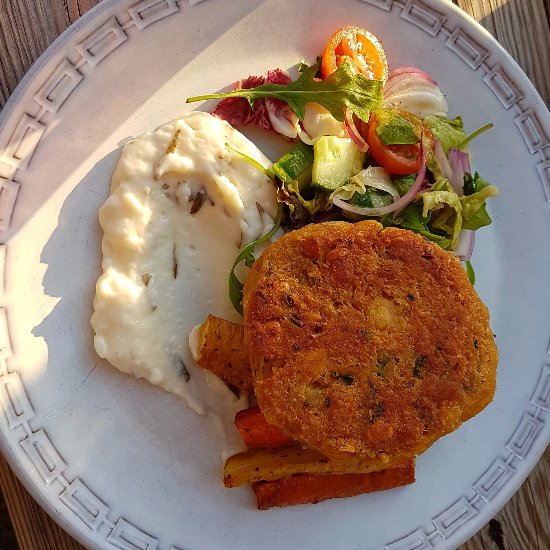
The width and height of the screenshot is (550, 550). What are the coordinates of `wood planks of table` in the screenshot? It's located at (31, 522), (520, 15), (19, 16).